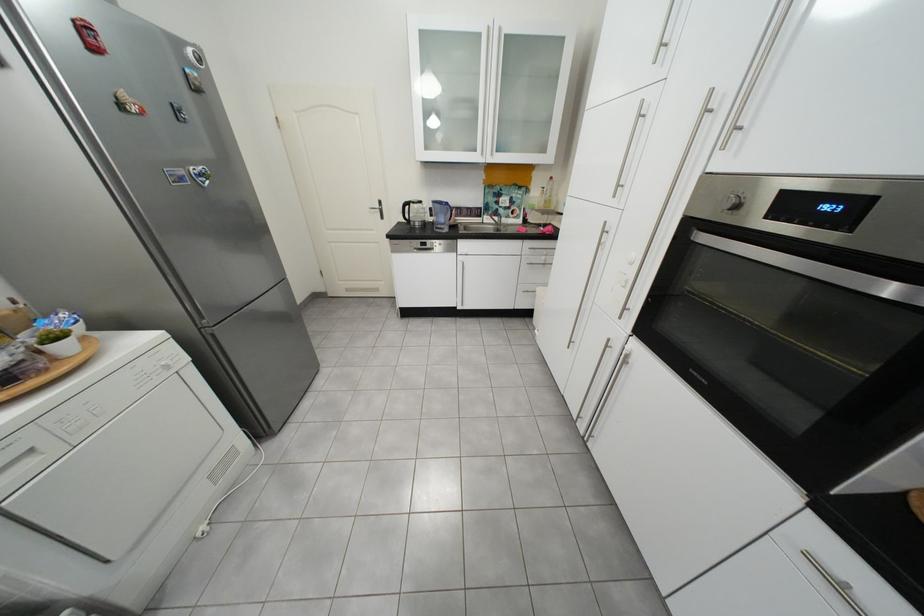
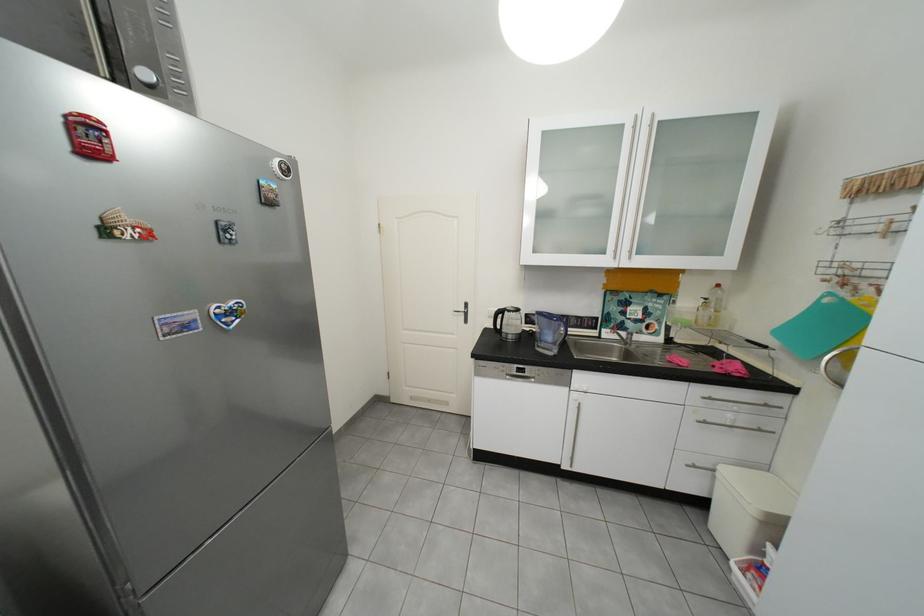
What movement of the cameraman would produce the second image?

The cameraman walked toward left, forward.